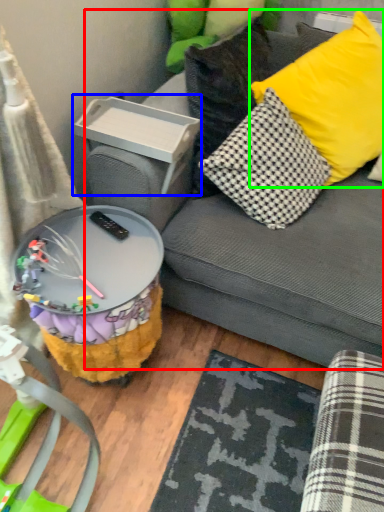
Question: Estimate the real-world distances between objects in this image. Which object is farther from studio couch (highlighted by a red box), storage box (highlighted by a blue box) or pillow (highlighted by a green box)?

Choices:
 (A) storage box
 (B) pillow

Answer: (A)